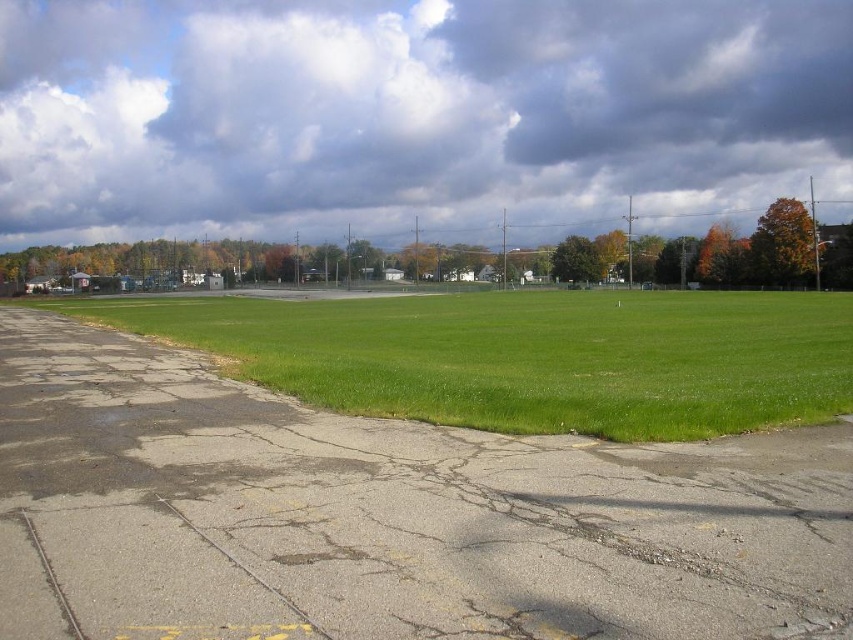
You are standing on the cracked asphalt road in the foreground of the image. Looking upwards, where exactly would you find the cloudy sky at upper in terms of coordinates?

The cloudy sky at upper is located at coordinates point (413, 115).

You are standing at the cracked asphalt road in the foreground of the scene. You see two points marked on the image, point 1 at coordinates point (103, 205) and point 2 at coordinates point (613, 307). Which point is closer to you?

Point (103, 205) is closer to you because it is further to the viewer than point (613, 307).